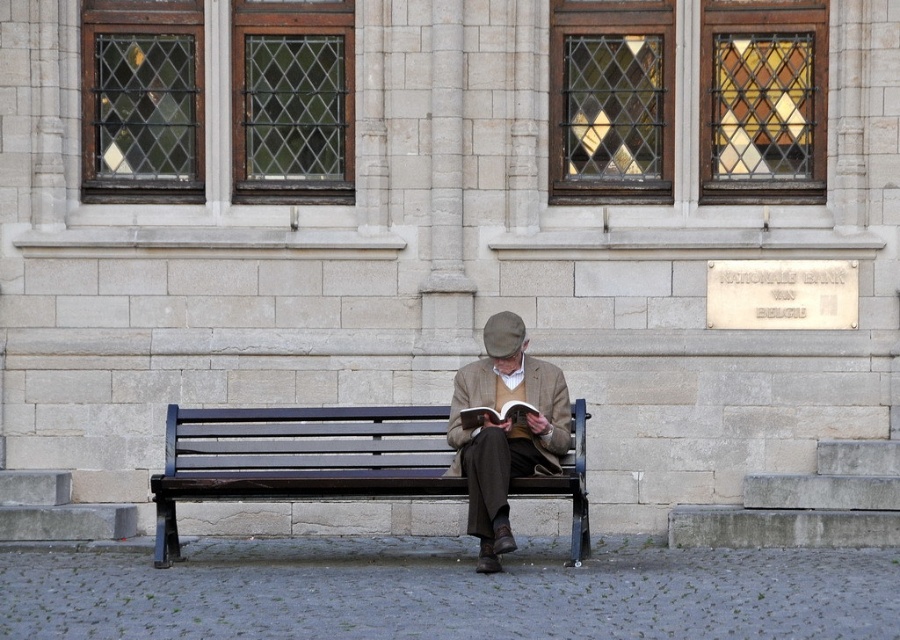
Question: Which is nearer to the dark brown wood bench at center?

Choices:
 (A) matte brown jacket at center
 (B) hardcover book at center

Answer: (A)

Question: Considering the relative positions of dark brown wood bench at center and silver metallic plaque at center right in the image provided, where is dark brown wood bench at center located with respect to silver metallic plaque at center right?

Choices:
 (A) left
 (B) right

Answer: (A)

Question: Can you confirm if silver metallic plaque at center right is positioned above hardcover book at center?

Choices:
 (A) yes
 (B) no

Answer: (A)

Question: Estimate the real-world distances between objects in this image. Which object is farther from the matte brown jacket at center?

Choices:
 (A) dark brown wood bench at center
 (B) silver metallic plaque at center right
 (C) hardcover book at center

Answer: (B)

Question: Considering the real-world distances, which object is farthest from the matte brown jacket at center?

Choices:
 (A) silver metallic plaque at center right
 (B) dark brown wood bench at center

Answer: (A)

Question: Can you confirm if matte brown jacket at center is positioned to the right of silver metallic plaque at center right?

Choices:
 (A) no
 (B) yes

Answer: (A)